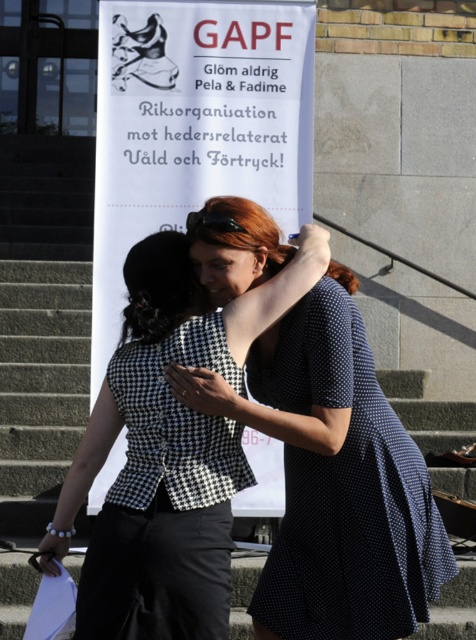
Question: Among these objects, which one is nearest to the camera?

Choices:
 (A) black checkered blouse at center
 (B) white paper banner at center
 (C) dark blue dotted dress at center

Answer: (A)

Question: Can you confirm if white paper banner at center is thinner than black houndstooth fabric dress at center?

Choices:
 (A) no
 (B) yes

Answer: (A)

Question: Which object is positioned farthest from the white paper banner at center?

Choices:
 (A) black houndstooth fabric dress at center
 (B) dark blue dotted dress at center

Answer: (A)

Question: Can you confirm if white paper banner at center is positioned to the left of black houndstooth fabric dress at center?

Choices:
 (A) yes
 (B) no

Answer: (A)

Question: Which point is farther to the camera?

Choices:
 (A) dark blue dotted dress at center
 (B) white paper banner at center
 (C) black houndstooth fabric dress at center

Answer: (B)

Question: Does black checkered blouse at center appear on the left side of white paper banner at center?

Choices:
 (A) yes
 (B) no

Answer: (B)